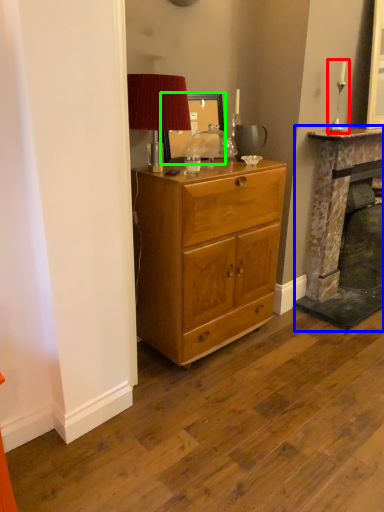
Question: Based on their relative distances, which object is nearer to candle holder (highlighted by a red box)? Choose from fireplace (highlighted by a blue box) and picture frame (highlighted by a green box).

Choices:
 (A) fireplace
 (B) picture frame

Answer: (A)